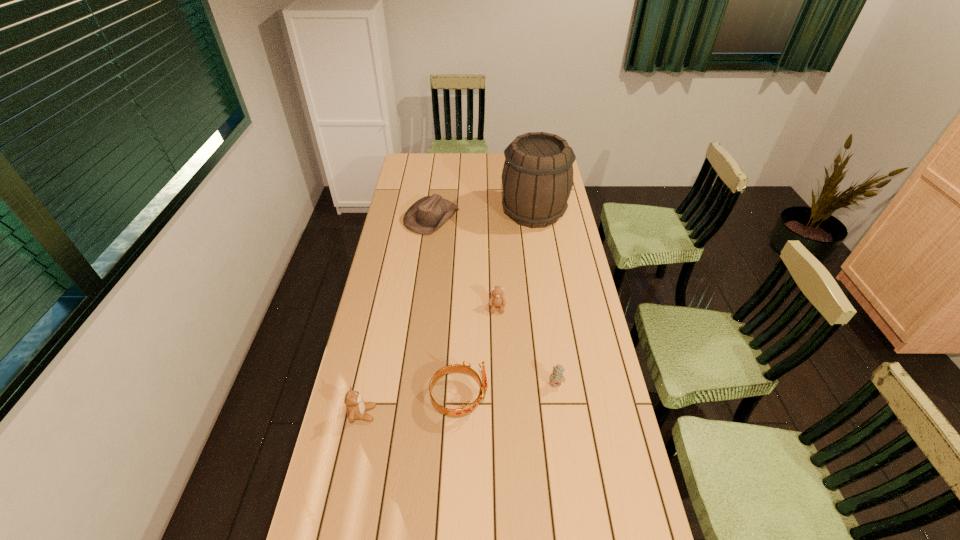
Locate an element on the screen. This screenshot has width=960, height=540. vacant area at the right edge is located at coordinates (554, 225).

Find the location of a particular element. vacant area between the second tallest object and the tallest teddy bear is located at coordinates (411, 406).

The width and height of the screenshot is (960, 540). I want to click on unoccupied position between the tallest object and the fedora, so click(x=483, y=215).

This screenshot has width=960, height=540. I want to click on free space that is in between the leftmost teddy bear and the second nearest teddy bear, so click(459, 399).

Locate an element on the screen. This screenshot has width=960, height=540. unoccupied area between the fedora and the wine bucket is located at coordinates (483, 215).

Identify the location of vacant space that is in between the leftmost teddy bear and the farthest teddy bear. (430, 361).

I want to click on vacant area between the tiara and the fedora, so click(445, 308).

The height and width of the screenshot is (540, 960). I want to click on vacant space that's between the second nearest teddy bear and the tallest teddy bear, so click(x=459, y=399).

Where is `blank region between the second farthest teddy bear and the third object from right to left`? The image size is (960, 540). blank region between the second farthest teddy bear and the third object from right to left is located at coordinates (527, 346).

Identify the location of object that ranks as the fifth closest to the tiara. The width and height of the screenshot is (960, 540). (537, 179).